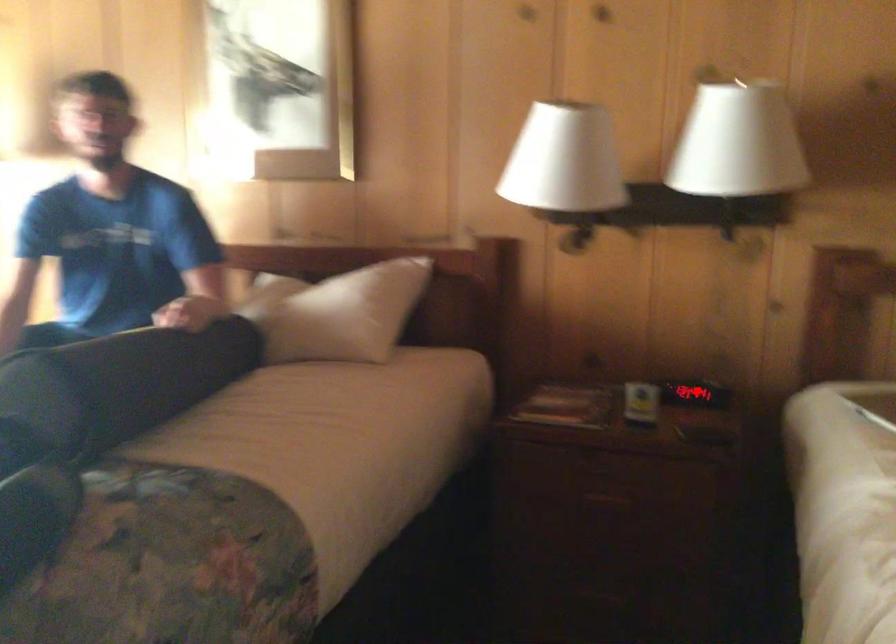
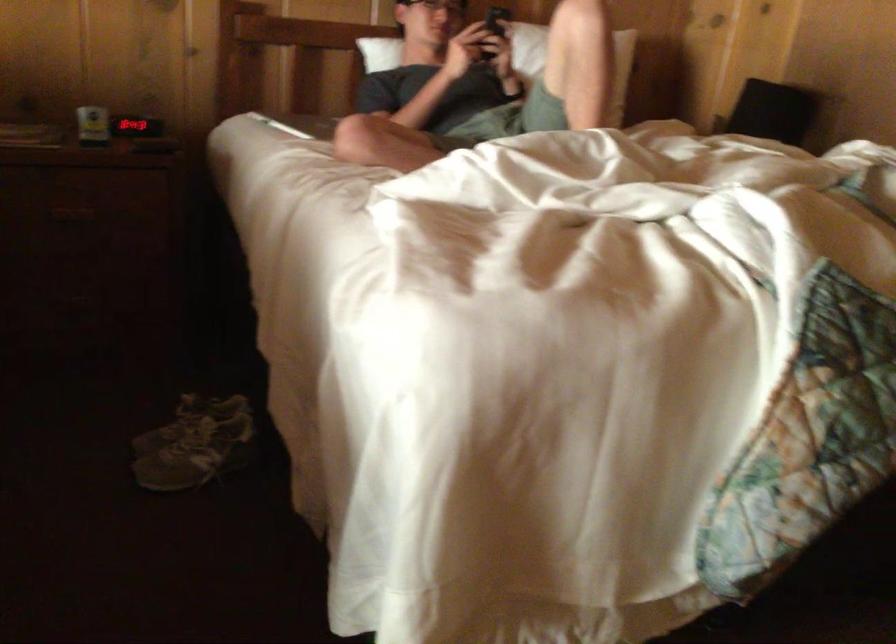
Where in the second image is the point corresponding to the highlighted location from the first image?

(135, 126)